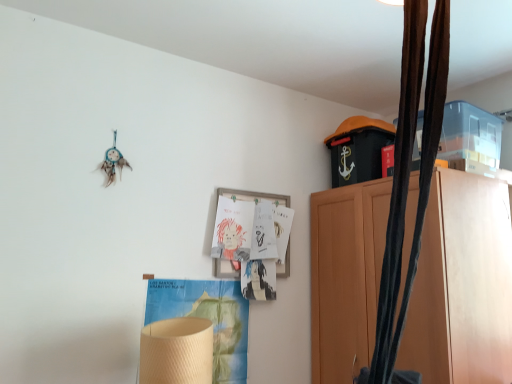
Question: From a real-world perspective, is wooden picture frame at center beneath wooden cabinet at upper right?

Choices:
 (A) yes
 (B) no

Answer: (B)

Question: Can you confirm if wooden picture frame at center is smaller than wooden cabinet at upper right?

Choices:
 (A) no
 (B) yes

Answer: (B)

Question: Would you say wooden picture frame at center is outside wooden cabinet at upper right?

Choices:
 (A) yes
 (B) no

Answer: (A)

Question: Does wooden picture frame at center come in front of wooden cabinet at upper right?

Choices:
 (A) no
 (B) yes

Answer: (A)

Question: Is wooden cabinet at upper right at the back of wooden picture frame at center?

Choices:
 (A) yes
 (B) no

Answer: (B)

Question: From the image's perspective, is wooden picture frame at center below wooden cabinet at upper right?

Choices:
 (A) no
 (B) yes

Answer: (A)

Question: Considering the relative sizes of wooden cabinet at upper right and wooden picture frame at center in the image provided, is wooden cabinet at upper right wider than wooden picture frame at center?

Choices:
 (A) yes
 (B) no

Answer: (A)

Question: Does wooden cabinet at upper right have a larger size compared to wooden picture frame at center?

Choices:
 (A) yes
 (B) no

Answer: (A)

Question: Does wooden cabinet at upper right have a lesser height compared to wooden picture frame at center?

Choices:
 (A) yes
 (B) no

Answer: (B)

Question: From the image's perspective, does wooden cabinet at upper right appear lower than wooden picture frame at center?

Choices:
 (A) no
 (B) yes

Answer: (B)

Question: Is wooden cabinet at upper right not inside wooden picture frame at center?

Choices:
 (A) yes
 (B) no

Answer: (A)

Question: From a real-world perspective, is wooden cabinet at upper right located higher than wooden picture frame at center?

Choices:
 (A) no
 (B) yes

Answer: (A)

Question: Considering the positions of wooden picture frame at center and wooden cabinet at upper right in the image, is wooden picture frame at center bigger or smaller than wooden cabinet at upper right?

Choices:
 (A) big
 (B) small

Answer: (B)